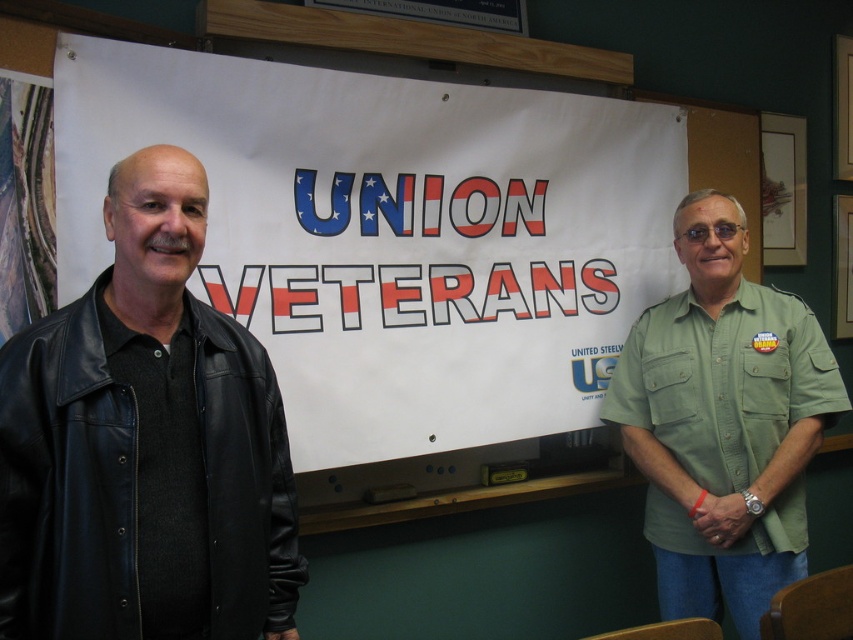
Question: Which object appears farthest from the camera in this image?

Choices:
 (A) white paper at center
 (B) black leather jacket at left
 (C) green uniform shirt at right

Answer: (C)

Question: Does white paper at center lie behind green uniform shirt at right?

Choices:
 (A) yes
 (B) no

Answer: (B)

Question: Does white paper at center have a larger size compared to black leather jacket at left?

Choices:
 (A) yes
 (B) no

Answer: (A)

Question: Is white paper at center bigger than black leather jacket at left?

Choices:
 (A) yes
 (B) no

Answer: (A)

Question: Which point is closer to the camera?

Choices:
 (A) (141, 83)
 (B) (165, 200)

Answer: (B)

Question: Which of the following is the farthest from the observer?

Choices:
 (A) green uniform shirt at right
 (B) black leather jacket at left
 (C) white paper at center

Answer: (A)